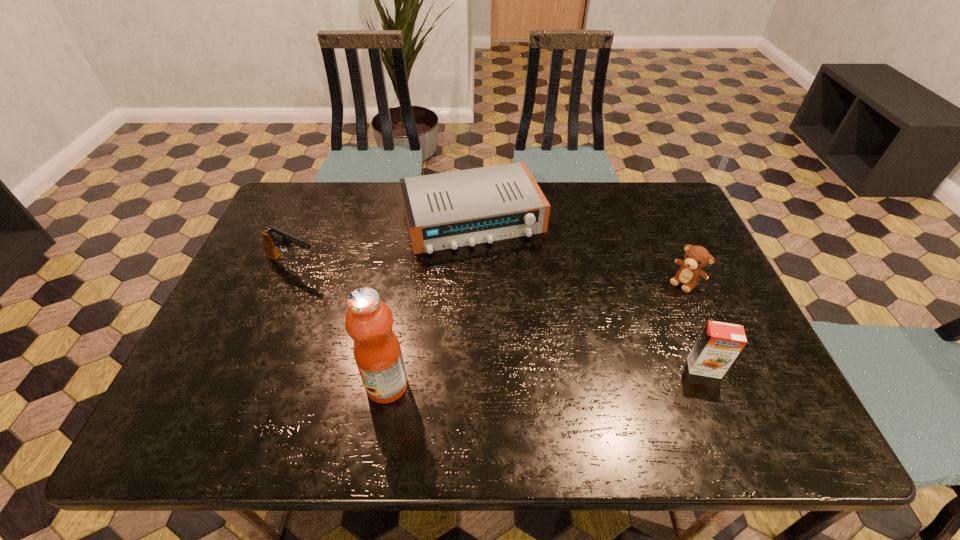
The width and height of the screenshot is (960, 540). I want to click on empty location between the orange juice and the radio receiver, so click(x=588, y=294).

At what (x,y) coordinates should I click in order to perform the action: click on object that stands as the second closest to the shortest object. Please return your answer as a coordinate pair (x, y). Looking at the image, I should click on (696, 257).

Locate an element on the screen. Image resolution: width=960 pixels, height=540 pixels. object that stands as the second closest to the orange juice is located at coordinates (446, 210).

The image size is (960, 540). I want to click on blank area in the image that satisfies the following two spatial constraints: 1. on the front side of the orange juice; 2. on the left side of the gun, so click(250, 368).